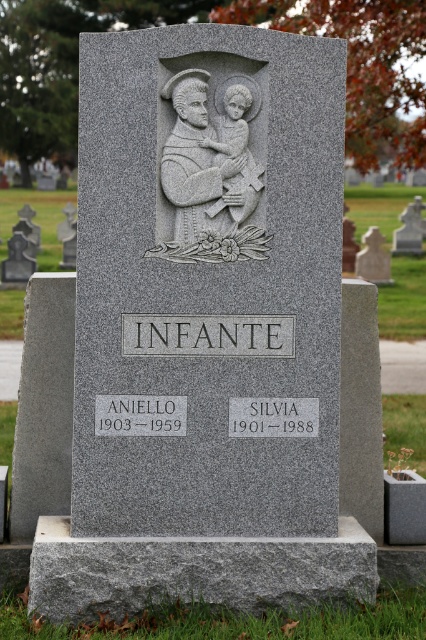
You are standing at the entrance of the cemetery and want to place a bouquet of flowers at the base of the gray granite statue at upper center. However, you are currently holding a large umbrella that is 1.2 meters in length. If you walk towards the granite gravestone at center, will you be able to reach the statue without having to put down your umbrella?

The distance between the gray granite statue at upper center and the granite gravestone at center is 3.77 meters. Since the umbrella is only 1.2 meters long, you would need to walk approximately 3.77 meters to reach the statue. However, the umbrella length does not affect your ability to reach the statue, as it is unrelated to the distance. You can simply walk towards the statue while holding the umbrella, and you will reach it without needing to put it down.

You are an archaeologist examining the gravestone. You notice two gray objects on it. The first is the gray stone sculpture of man holding child at center, and the second is the gray granite statue at upper center. Which of these two objects is taller?

The gray granite statue at upper center is taller than the gray stone sculpture of man holding child at center.